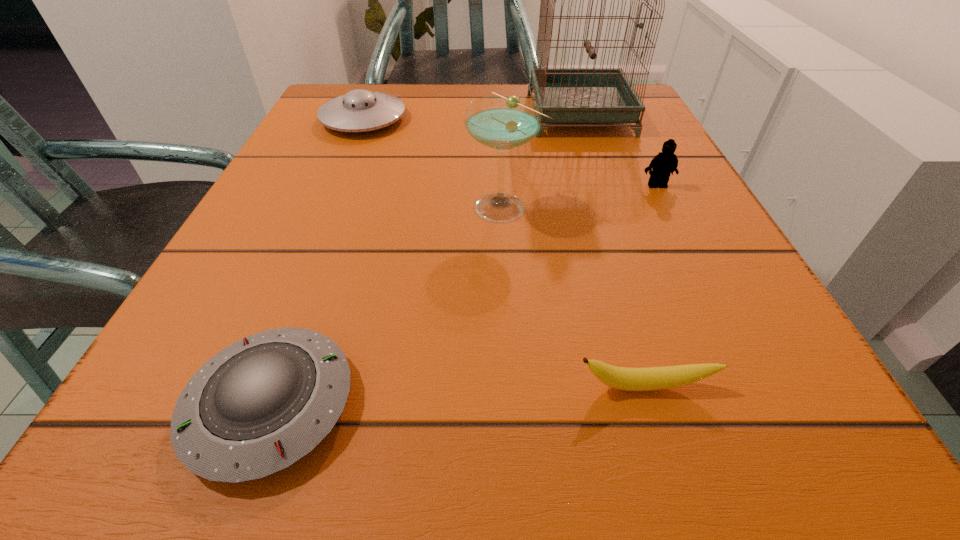
What are the coordinates of `banana at the right edge` in the screenshot? It's located at (653, 378).

Locate an element on the screen. The width and height of the screenshot is (960, 540). object present at the far left corner is located at coordinates (359, 110).

I want to click on object at the near left corner, so click(x=261, y=404).

Identify the location of object present at the far right corner. (567, 95).

Where is `vacant area at the far edge`? This screenshot has width=960, height=540. vacant area at the far edge is located at coordinates (403, 86).

This screenshot has height=540, width=960. In order to click on free space at the near edge of the desktop in this screenshot , I will do (356, 445).

Find the location of a particular element. The width and height of the screenshot is (960, 540). vacant area at the left edge of the desktop is located at coordinates (282, 164).

Identify the location of vacant region at the right edge of the desktop. (625, 166).

Locate an element on the screen. The height and width of the screenshot is (540, 960). free spot between the banana and the fourth shortest object is located at coordinates (651, 286).

Where is `free space between the fourth object from right to left and the tallest object`? free space between the fourth object from right to left and the tallest object is located at coordinates (541, 160).